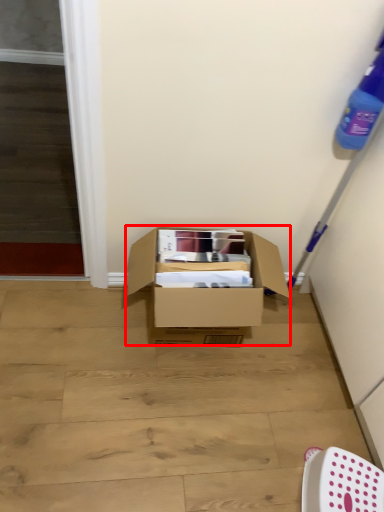
Question: From the image's perspective, what is the correct spatial relationship of box (annotated by the red box) in relation to chair?

Choices:
 (A) above
 (B) below

Answer: (A)